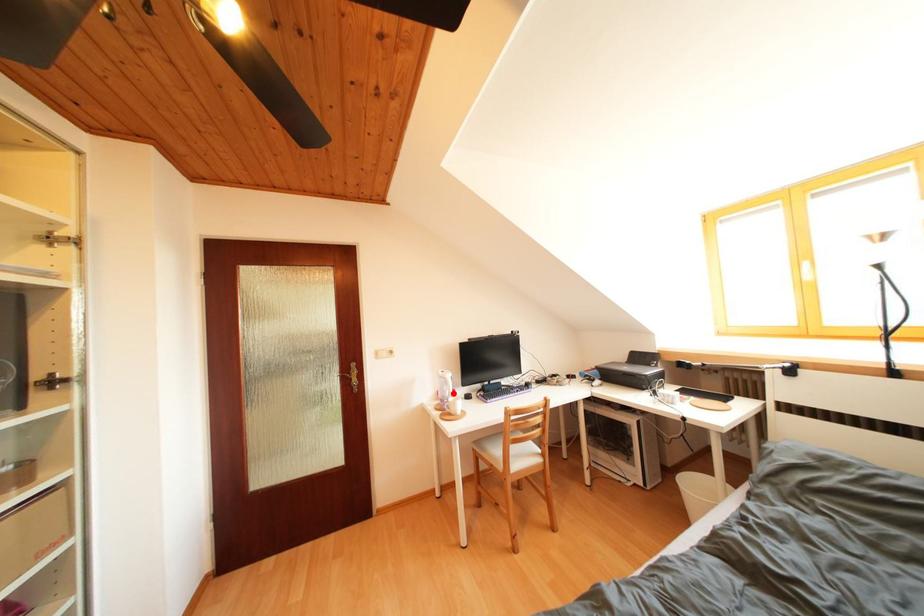
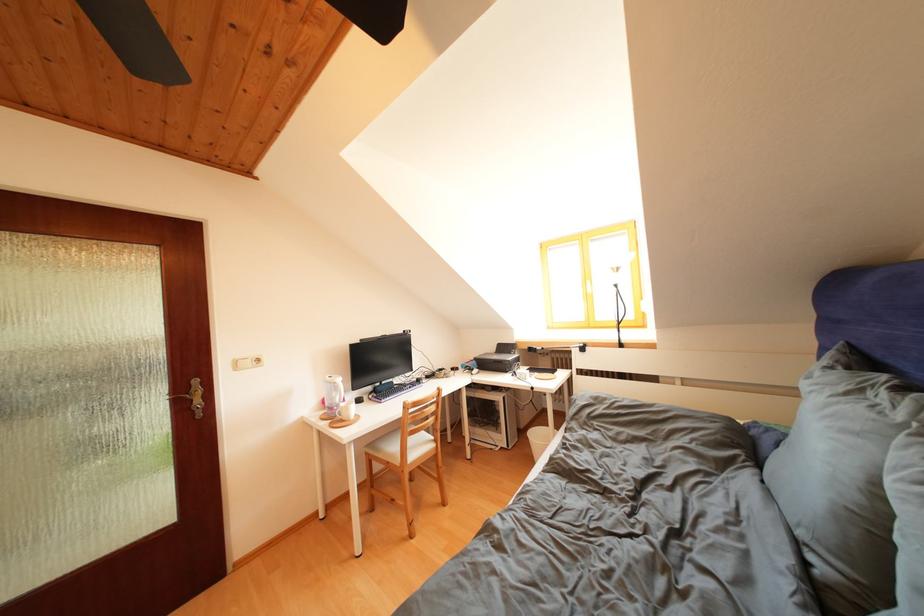
Question: I am providing you with two images of the same scene from different viewpoints. Image1 has a red point marked. In image2, the corresponding 3D location appears at what relative position? Reply with the corresponding letter.

Choices:
 (A) Closer
 (B) Farther

Answer: (A)